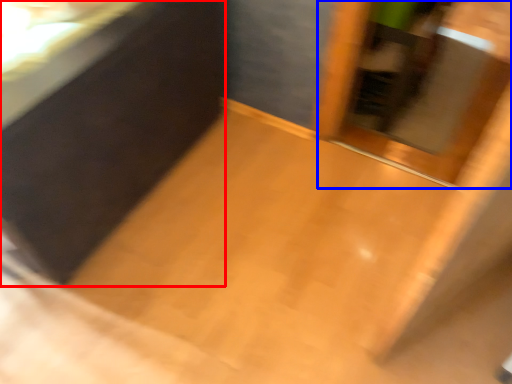
Question: Which object appears farthest to the camera in this image, vanity (highlighted by a red box) or screen door (highlighted by a blue box)?

Choices:
 (A) vanity
 (B) screen door

Answer: (B)